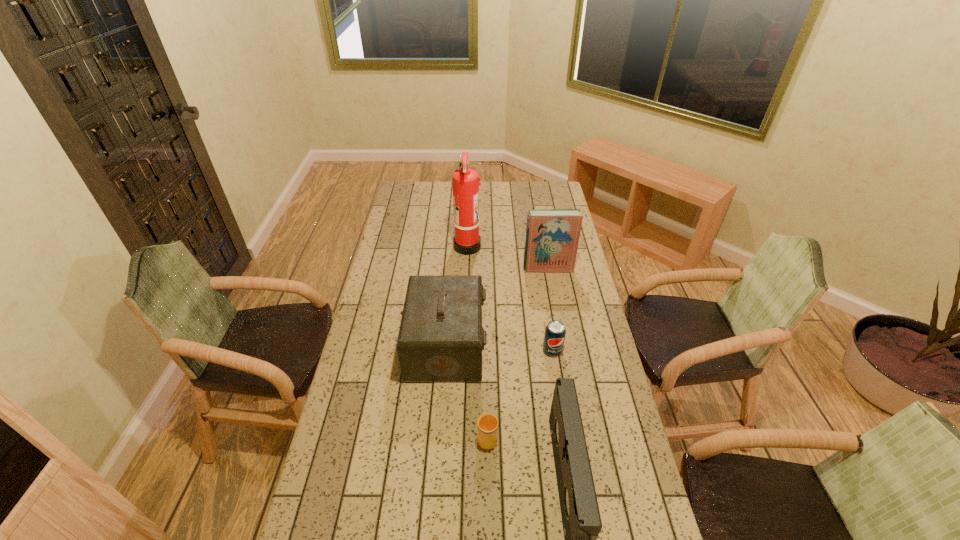
This screenshot has height=540, width=960. Identify the location of vacant area located 0.120m on the back of the soda can. (547, 320).

This screenshot has width=960, height=540. Identify the location of vacant region located 0.120m on the side of the cup with the handle. (487, 392).

Find the location of a particular element. This screenshot has height=540, width=960. vacant area situated on the side of the cup with the handle is located at coordinates tap(487, 368).

Image resolution: width=960 pixels, height=540 pixels. I want to click on free space located 0.160m on the side of the cup with the handle, so click(487, 382).

Locate an element on the screen. The image size is (960, 540). hardback book that is at the right edge is located at coordinates [552, 235].

Where is `soda can present at the right edge`? soda can present at the right edge is located at coordinates (554, 337).

Locate an element on the screen. The image size is (960, 540). free spot at the far edge of the desktop is located at coordinates (493, 183).

At what (x,y) coordinates should I click in order to perform the action: click on free spot at the left edge of the desktop. Please return your answer as a coordinate pair (x, y). The width and height of the screenshot is (960, 540). Looking at the image, I should click on 379,276.

What are the coordinates of `free region at the right edge of the desktop` in the screenshot? It's located at (571, 343).

At what (x,y) coordinates should I click in order to perform the action: click on vacant space at the far right corner of the desktop. Please return your answer as a coordinate pair (x, y). Image resolution: width=960 pixels, height=540 pixels. Looking at the image, I should click on (537, 183).